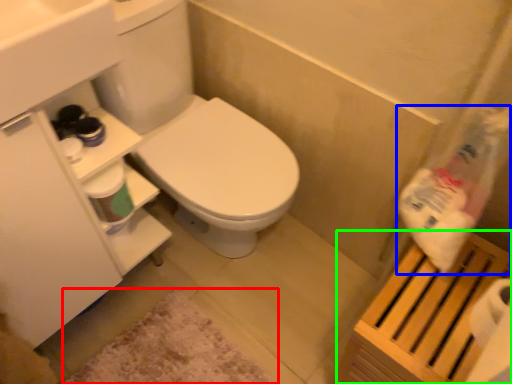
Question: Which is nearer to the bath mat (highlighted by a red box)? cleaning product (highlighted by a blue box) or shelf (highlighted by a green box).

Choices:
 (A) cleaning product
 (B) shelf

Answer: (B)